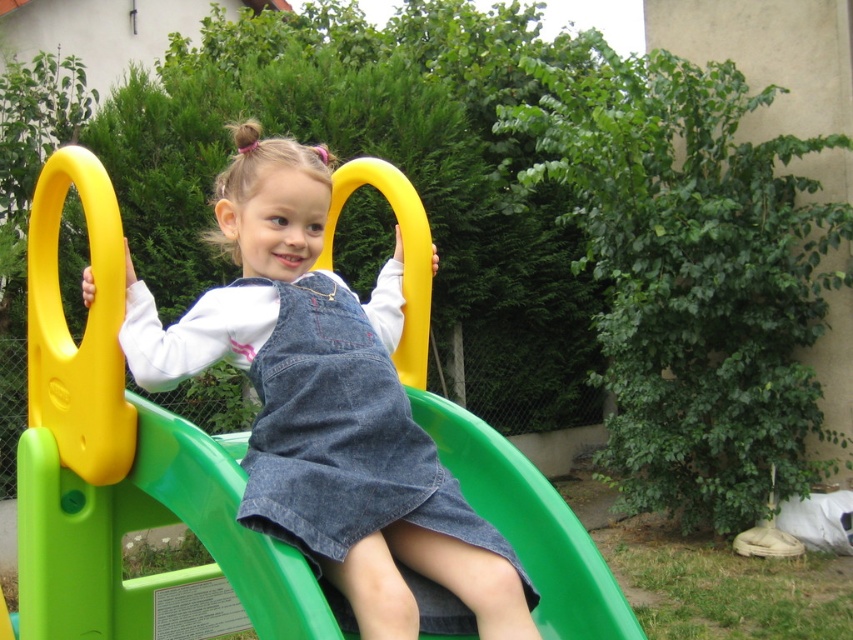
You are a photographer trying to capture the girl in the scene. You notice both the denim overalls at center and the denim dress at center. Which piece of clothing is closer to you?

The denim overalls at center are closer to you because they are positioned further to the viewer than the denim dress at center.

You are a parent trying to decide which outfit your child should wear today. You have two options in the image, the denim overalls at center and the denim dress at center. Since they are both denim, you want to choose the one that is closer to the slide. Which one should you pick?

The denim overalls at center and denim dress at center are 3.23 centimeters apart from each other, so you can choose either since they are both equally close to the slide.

The young girl is wearing two denim items. Which one is on the right side when looking at the denim overalls at center and the denim dress at center?

The denim overalls at center is positioned on the right side of the denim dress at center.